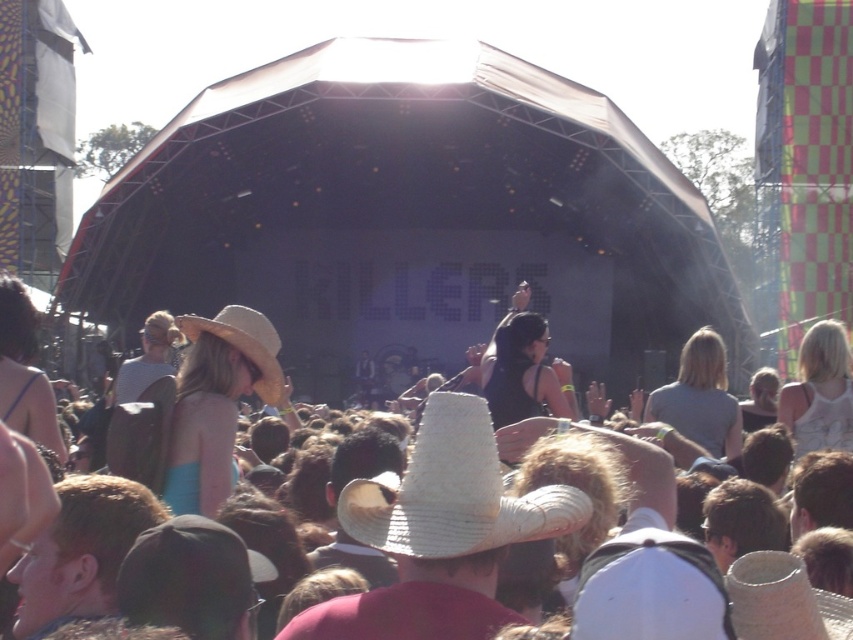
Is white straw cowboy hat at center closer to camera compared to strawmaterial/texturehat at upper center?

Yes, it is.

Looking at this image, which is more to the right, white straw cowboy hat at center or strawmaterial/texturehat at upper center?

Positioned to the right is white straw cowboy hat at center.

Identify the location of white straw cowboy hat at center. (454, 492).

Looking at this image, who is more distant from viewer, (183, 378) or (265, 358)?

The point (265, 358) is more distant.

Does straw hat at center appear over strawhat at left?

No, straw hat at center is not above strawhat at left.

Does point (198, 451) lie in front of point (242, 321)?

Yes, point (198, 451) is closer to viewer.

You are a GUI agent. You are given a task and a screenshot of the screen. Output one action in this format:
    pyautogui.click(x=<x>, y=<y>)
    Task: Click on the straw hat at center
    This screenshot has width=853, height=640.
    Given the screenshot: What is the action you would take?
    pyautogui.click(x=216, y=403)

Who is higher up, straw hat at center or strawmaterial/texturehat at upper center?

Positioned higher is strawmaterial/texturehat at upper center.

Can you confirm if straw hat at center is thinner than strawmaterial/texturehat at upper center?

Correct, straw hat at center's width is less than strawmaterial/texturehat at upper center's.

You are a GUI agent. You are given a task and a screenshot of the screen. Output one action in this format:
    pyautogui.click(x=<x>, y=<y>)
    Task: Click on the straw hat at center
    The height and width of the screenshot is (640, 853).
    Given the screenshot: What is the action you would take?
    pyautogui.click(x=216, y=403)

I want to click on straw hat at center, so click(216, 403).